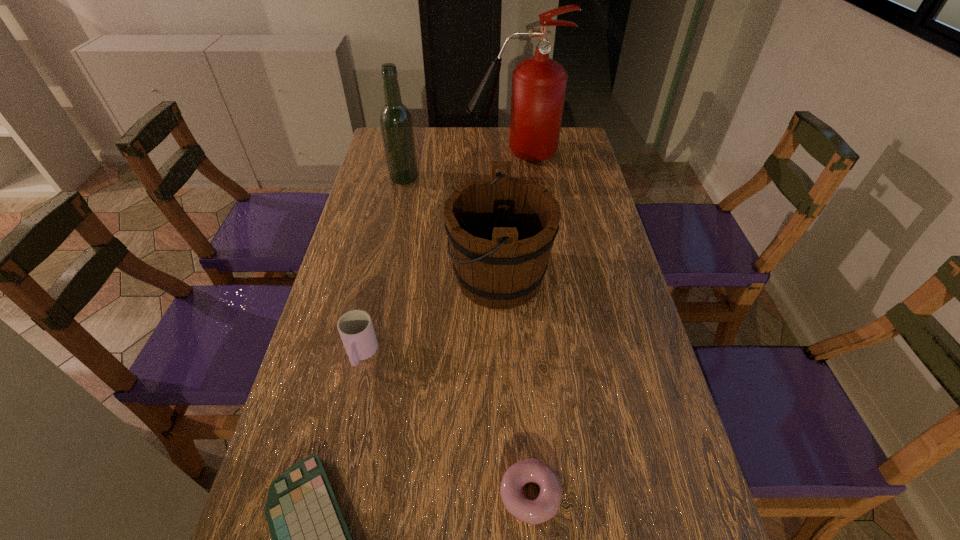
This screenshot has width=960, height=540. I want to click on vacant space located 0.220m with the nozzle aimed from the fire extinguisher, so click(x=408, y=154).

Identify the location of free region located 0.240m with the nozzle aimed from the fire extinguisher. Image resolution: width=960 pixels, height=540 pixels. (403, 154).

Where is `vacant space located 0.090m on the right of the liquor`? The image size is (960, 540). vacant space located 0.090m on the right of the liquor is located at coordinates (x=444, y=178).

You are a GUI agent. You are given a task and a screenshot of the screen. Output one action in this format:
    pyautogui.click(x=<x>, y=<y>)
    Task: Click on the free point located 0.220m on the side of the third tallest object with the handle for carrying
    This screenshot has width=960, height=540.
    Given the screenshot: What is the action you would take?
    pyautogui.click(x=369, y=278)

Identify the location of free point located on the side of the third tallest object with the handle for carrying. (347, 278).

Locate an element on the screen. The height and width of the screenshot is (540, 960). vacant space located on the side of the third tallest object with the handle for carrying is located at coordinates (350, 278).

Where is `free spot located with the handle on the side of the third nearest object`? This screenshot has width=960, height=540. free spot located with the handle on the side of the third nearest object is located at coordinates (324, 515).

At what (x,y) coordinates should I click in order to perform the action: click on vacant space situated on the right of the doughnut. Please return your answer as a coordinate pair (x, y). Image resolution: width=960 pixels, height=540 pixels. Looking at the image, I should click on (604, 494).

The image size is (960, 540). Identify the location of object that is positioned at the far edge. (539, 84).

In order to click on liquor situated at the left edge in this screenshot , I will do `click(396, 123)`.